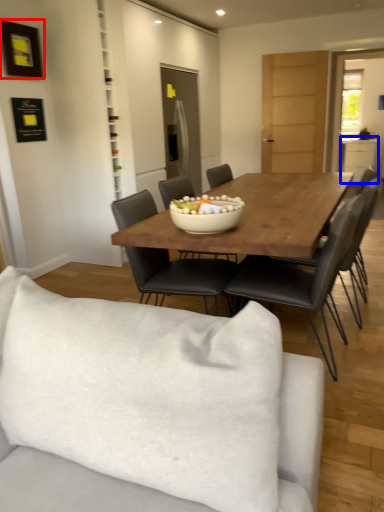
Question: Which of the following is the farthest to the observer, picture frame (highlighted by a red box) or cabinetry (highlighted by a blue box)?

Choices:
 (A) picture frame
 (B) cabinetry

Answer: (B)